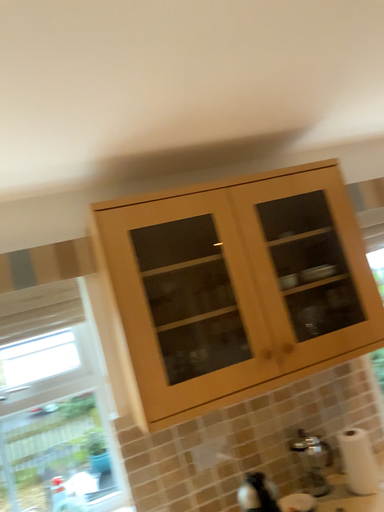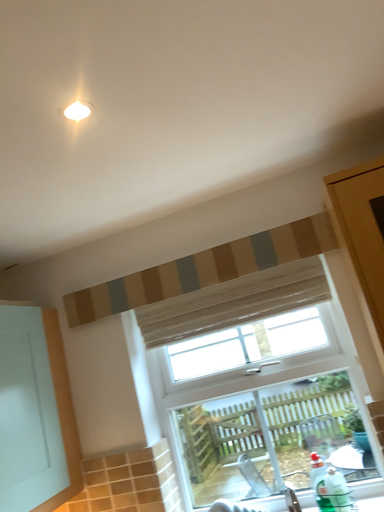
Question: Which way did the camera rotate in the video?

Choices:
 (A) rotated left
 (B) rotated right

Answer: (A)